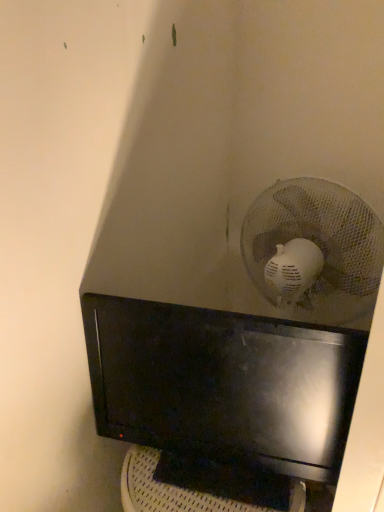
Question: Should I look upward or downward to see black glossy computer monitor at center?

Choices:
 (A) up
 (B) down

Answer: (B)